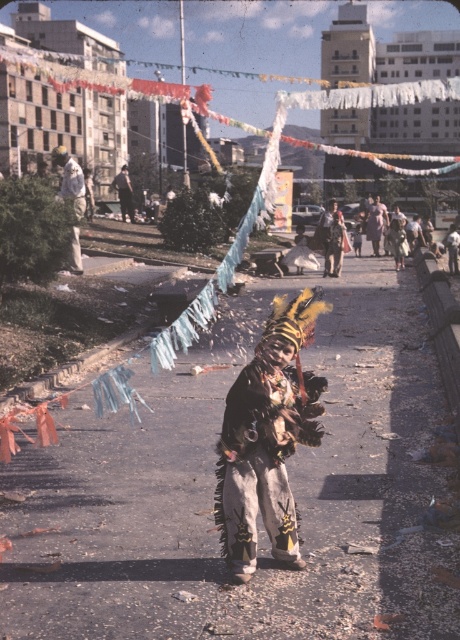
From the picture: You are a photographer at the event and want to capture a clear shot of the child in the fuzzy costume at center and the white cotton pants at center. Since the camera can only focus on one height at a time, which object should you adjust the focus to ensure both are in focus?

The fuzzy costume at center is shorter than white cotton pants at center. To ensure both are in focus, adjust the camera focus to the height of the white cotton pants at center, as it is taller and will encompass the shorter fuzzy costume at center within the focal range.

You are a photographer trying to capture the child in the center of the image. The child is wearing a multicolored feathered headdress at center and white cotton pants at center. Which object is positioned to the right when you look at the child?

The multicolored feathered headdress at center is to the right of the white cotton pants at center, so the multicolored feathered headdress at center is positioned to the right when looking at the child.

You are a photographer at the event and want to capture both the fuzzy costume at center and the white cotton pants at center in a single frame. Which object should you focus on first to ensure both are in the frame?

The fuzzy costume at center has a smaller size compared to white cotton pants at center, so you should focus on the fuzzy costume at center first to ensure both are captured in the frame.